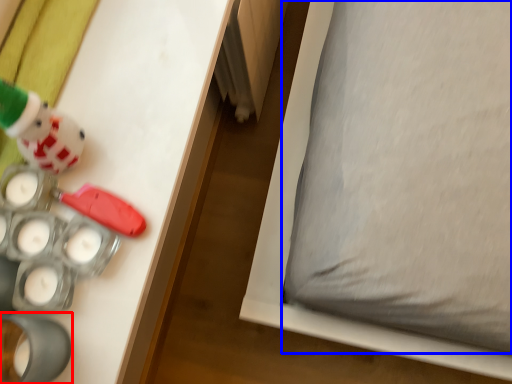
Question: Among these objects, which one is farthest to the camera, toy (highlighted by a red box) or pillow (highlighted by a blue box)?

Choices:
 (A) toy
 (B) pillow

Answer: (B)